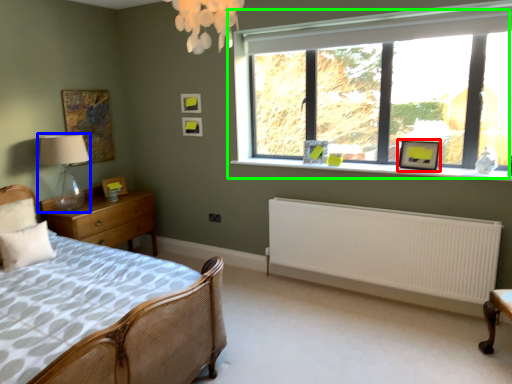
Question: Based on their relative distances, which object is farther from picture frame (highlighted by a red box)? Choose from table lamp (highlighted by a blue box) and window (highlighted by a green box).

Choices:
 (A) table lamp
 (B) window

Answer: (A)